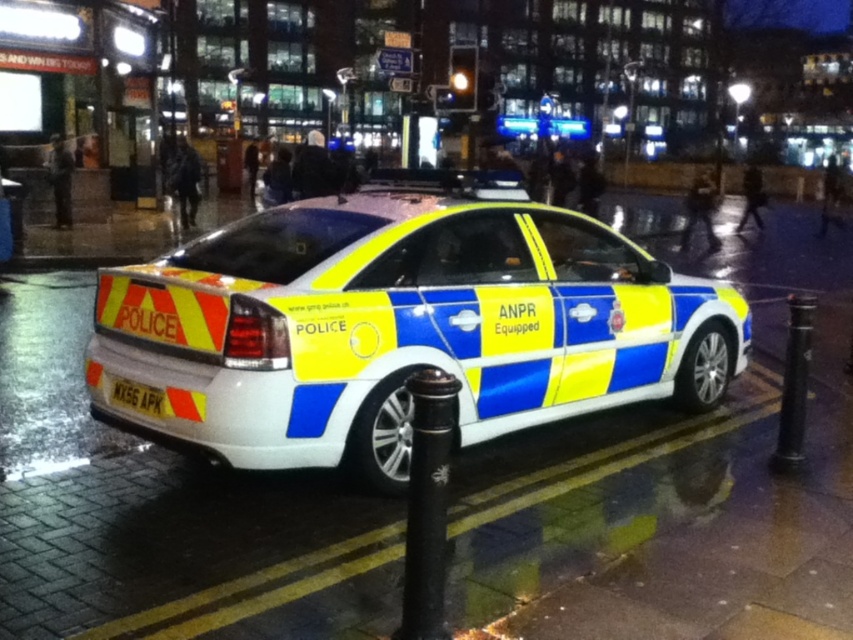
Can you confirm if yellow/blue checkered police car at center is positioned to the left of white plastic license plate at lower left?

No, yellow/blue checkered police car at center is not to the left of white plastic license plate at lower left.

Does yellow/blue checkered police car at center have a larger size compared to white plastic license plate at lower left?

Indeed, yellow/blue checkered police car at center has a larger size compared to white plastic license plate at lower left.

Between point (537, 330) and point (160, 413), which one is positioned in front?

Point (160, 413)

Identify the location of yellow/blue checkered police car at center. This screenshot has width=853, height=640. coord(401,330).

Which of these two, black metal pole at center or white plastic license plate at lower left, stands shorter?

white plastic license plate at lower left

Is black metal pole at center wider than white plastic license plate at lower left?

No, black metal pole at center is not wider than white plastic license plate at lower left.

Is point (422, 477) positioned behind point (144, 390)?

No.

Where is `black metal pole at center`? This screenshot has height=640, width=853. black metal pole at center is located at coordinates (427, 504).

Locate an element on the screen. Image resolution: width=853 pixels, height=640 pixels. yellow/blue checkered police car at center is located at coordinates (401, 330).

Can you confirm if yellow/blue checkered police car at center is smaller than black metal pole at center?

No.

Which is behind, point (671, 378) or point (422, 412)?

The point (671, 378) is behind.

You are a GUI agent. You are given a task and a screenshot of the screen. Output one action in this format:
    pyautogui.click(x=<x>, y=<y>)
    Task: Click on the yellow/blue checkered police car at center
    The width and height of the screenshot is (853, 640).
    Given the screenshot: What is the action you would take?
    pyautogui.click(x=401, y=330)